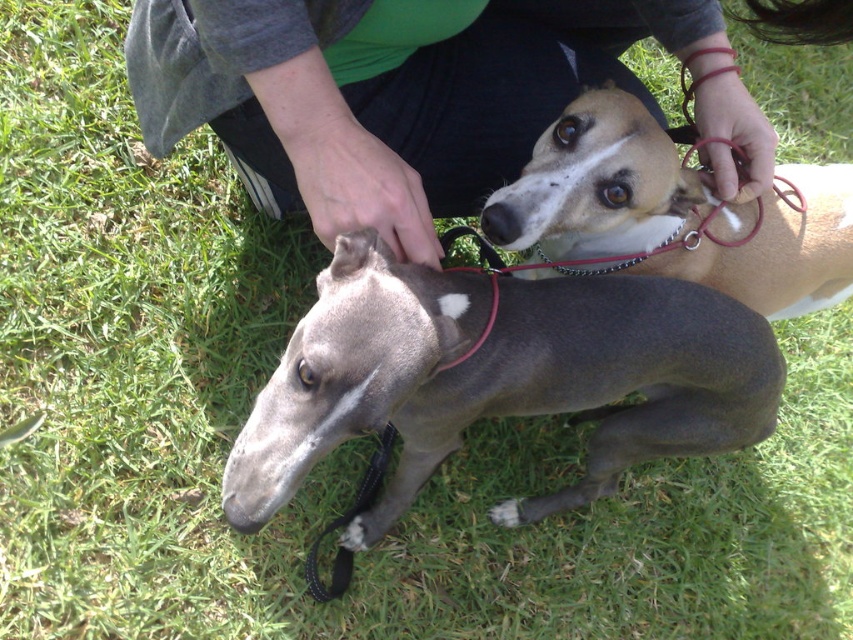
Question: Is green fabric shirt at upper center above brown smooth dog at center?

Choices:
 (A) no
 (B) yes

Answer: (B)

Question: Which object is closer to the camera taking this photo?

Choices:
 (A) green fabric shirt at upper center
 (B) brown smooth dog at center
 (C) smooth gray dog at center

Answer: (C)

Question: In this image, where is smooth gray dog at center located relative to green fabric shirt at upper center?

Choices:
 (A) above
 (B) below

Answer: (B)

Question: Does smooth gray dog at center appear under brown smooth dog at center?

Choices:
 (A) yes
 (B) no

Answer: (A)

Question: Which point is farther from the camera taking this photo?

Choices:
 (A) (643, 384)
 (B) (485, 220)
 (C) (267, 147)

Answer: (C)

Question: Which point is farther to the camera?

Choices:
 (A) brown smooth dog at center
 (B) green fabric shirt at upper center

Answer: (A)